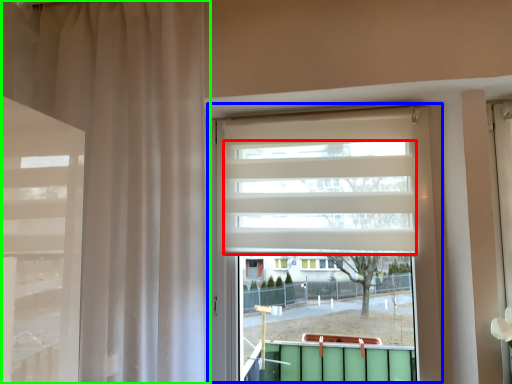
Question: Based on their relative distances, which object is nearer to blind (highlighted by a red box)? Choose from window (highlighted by a blue box) and curtain (highlighted by a green box).

Choices:
 (A) window
 (B) curtain

Answer: (A)